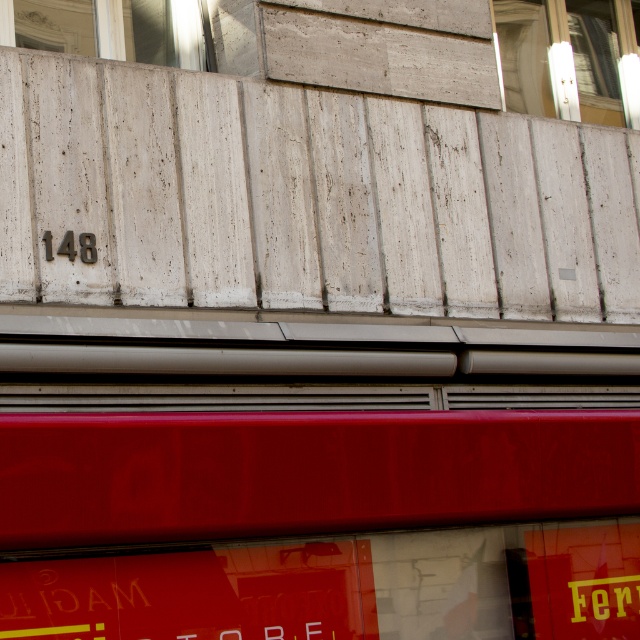
Question: Does clear glass window at upper right appear on the right side of white marble window at upper left?

Choices:
 (A) no
 (B) yes

Answer: (B)

Question: Does clear glass window at upper right appear over white marble window at upper left?

Choices:
 (A) no
 (B) yes

Answer: (B)

Question: Can you confirm if clear glass window at upper right is smaller than white marble window at upper left?

Choices:
 (A) yes
 (B) no

Answer: (B)

Question: Which object appears farthest from the camera in this image?

Choices:
 (A) white marble window at upper left
 (B) clear glass window at upper right

Answer: (B)